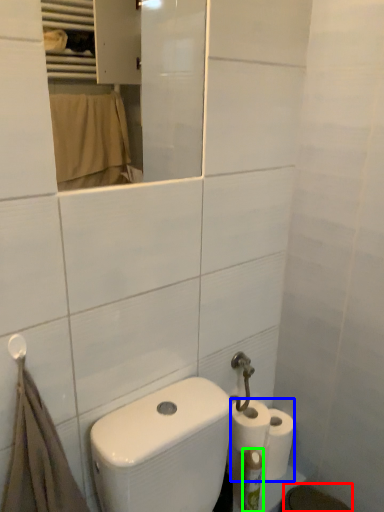
Question: Based on their relative distances, which object is farther from bidet (highlighted by a red box)? Choose from toilet paper (highlighted by a blue box) and toiletry (highlighted by a green box).

Choices:
 (A) toilet paper
 (B) toiletry

Answer: (A)